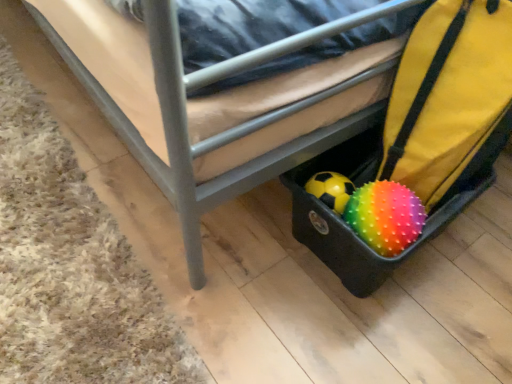
Question: Is brown carpet at lower left to the right of rainbow spiky ball at lower right from the viewer's perspective?

Choices:
 (A) yes
 (B) no

Answer: (B)

Question: Considering the relative positions of brown carpet at lower left and rainbow spiky ball at lower right in the image provided, is brown carpet at lower left to the left of rainbow spiky ball at lower right from the viewer's perspective?

Choices:
 (A) no
 (B) yes

Answer: (B)

Question: From a real-world perspective, is brown carpet at lower left under rainbow spiky ball at lower right?

Choices:
 (A) yes
 (B) no

Answer: (A)

Question: Can you confirm if brown carpet at lower left is bigger than rainbow spiky ball at lower right?

Choices:
 (A) no
 (B) yes

Answer: (B)

Question: Can you confirm if brown carpet at lower left is shorter than rainbow spiky ball at lower right?

Choices:
 (A) yes
 (B) no

Answer: (A)

Question: From a real-world perspective, is rubberized black suitcase at lower right physically located above or below brown carpet at lower left?

Choices:
 (A) below
 (B) above

Answer: (B)

Question: Is rubberized black suitcase at lower right inside the boundaries of brown carpet at lower left, or outside?

Choices:
 (A) inside
 (B) outside

Answer: (B)

Question: Is point pyautogui.click(x=440, y=16) closer or farther from the camera than point pyautogui.click(x=44, y=122)?

Choices:
 (A) farther
 (B) closer

Answer: (B)

Question: Relative to brown carpet at lower left, is rubberized black suitcase at lower right in front or behind?

Choices:
 (A) front
 (B) behind

Answer: (B)

Question: Looking at their shapes, would you say brown carpet at lower left is wider or thinner than black plastic suitcase at lower right?

Choices:
 (A) wide
 (B) thin

Answer: (B)

Question: From the image's perspective, is brown carpet at lower left positioned above or below black plastic suitcase at lower right?

Choices:
 (A) below
 (B) above

Answer: (A)

Question: Is brown carpet at lower left situated inside black plastic suitcase at lower right or outside?

Choices:
 (A) inside
 (B) outside

Answer: (B)

Question: Does point (45, 324) appear closer or farther from the camera than point (288, 162)?

Choices:
 (A) farther
 (B) closer

Answer: (B)

Question: From the image's perspective, relative to brown carpet at lower left, is rainbow spiky ball at lower right above or below?

Choices:
 (A) above
 (B) below

Answer: (B)

Question: Is rainbow spiky ball at lower right taller or shorter than brown carpet at lower left?

Choices:
 (A) tall
 (B) short

Answer: (A)